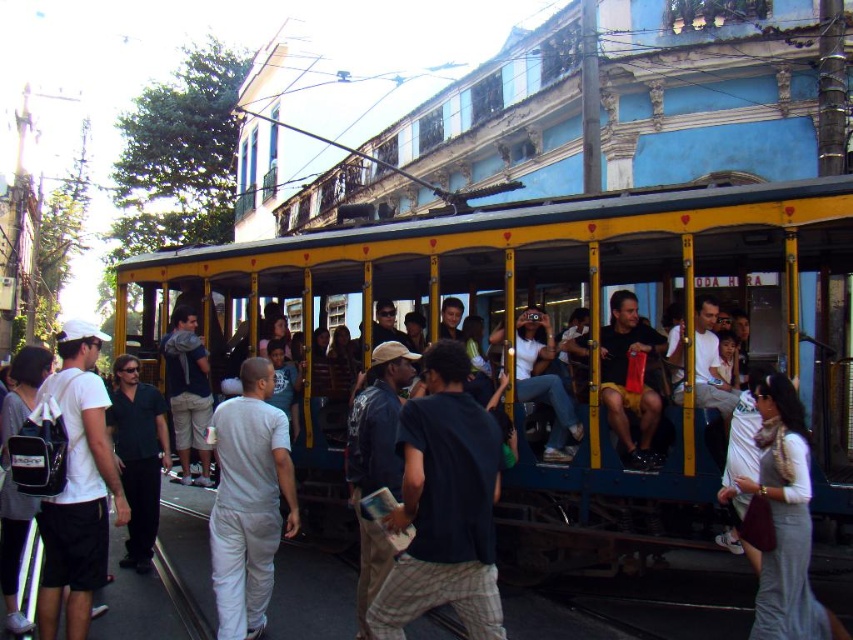
Is gray cotton shirt at center below matte black backpack at left?

Yes.

Is point (267, 509) positioned before point (6, 624)?

No, it is behind (6, 624).

Which is behind, point (242, 577) or point (3, 538)?

The point (3, 538) is behind.

Image resolution: width=853 pixels, height=640 pixels. Find the location of `gray cotton shirt at center`. gray cotton shirt at center is located at coordinates (248, 500).

Is yellow painted metal trolley at center thinner than gray cotton shirt at center?

No.

Between yellow painted metal trolley at center and gray cotton shirt at center, which one has more height?

yellow painted metal trolley at center is taller.

What do you see at coordinates (529, 317) in the screenshot? This screenshot has width=853, height=640. I see `yellow painted metal trolley at center` at bounding box center [529, 317].

The height and width of the screenshot is (640, 853). Find the location of `yellow painted metal trolley at center`. yellow painted metal trolley at center is located at coordinates (529, 317).

Who is positioned more to the left, gray cotton shirt at center or light gray scarf at center?

From the viewer's perspective, gray cotton shirt at center appears more on the left side.

Is the position of gray cotton shirt at center more distant than that of light gray scarf at center?

Yes, it is.

Is point (264, 496) farther from viewer compared to point (793, 416)?

That is True.

This screenshot has width=853, height=640. I want to click on gray cotton shirt at center, so click(248, 500).